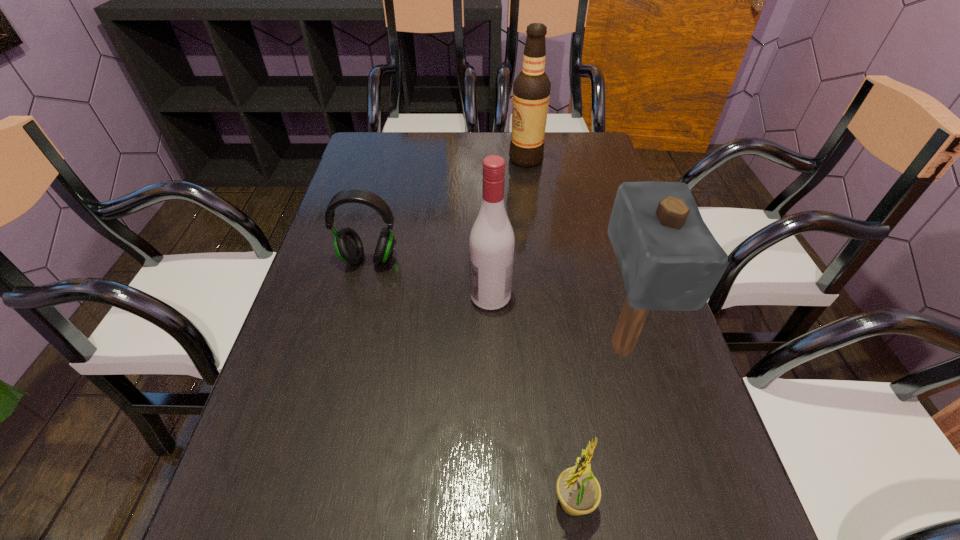
The image size is (960, 540). Find the location of `object that is positioned at the left edge`. object that is positioned at the left edge is located at coordinates (347, 243).

Where is `object that is at the right edge`? object that is at the right edge is located at coordinates (669, 259).

Locate an element on the screen. The height and width of the screenshot is (540, 960). free region at the far edge of the desktop is located at coordinates (470, 168).

Where is `vacant space at the left edge of the desktop`? vacant space at the left edge of the desktop is located at coordinates (336, 264).

In the image, there is a desktop. At what (x,y) coordinates should I click in order to perform the action: click on vacant area at the right edge. Please return your answer as a coordinate pair (x, y). The height and width of the screenshot is (540, 960). Looking at the image, I should click on (593, 244).

What are the coordinates of `vacant region at the far left corner of the desktop` in the screenshot? It's located at (351, 165).

Identify the location of vacant space at the far right corner of the desktop. (560, 152).

In order to click on vacant area that lies between the headset and the farther alcohol in this screenshot , I will do point(447,209).

The image size is (960, 540). Find the location of `free spot between the left alcohol and the nearest object`. free spot between the left alcohol and the nearest object is located at coordinates (532, 399).

Image resolution: width=960 pixels, height=540 pixels. Identify the location of empty space between the farthest object and the rightmost object. (574, 252).